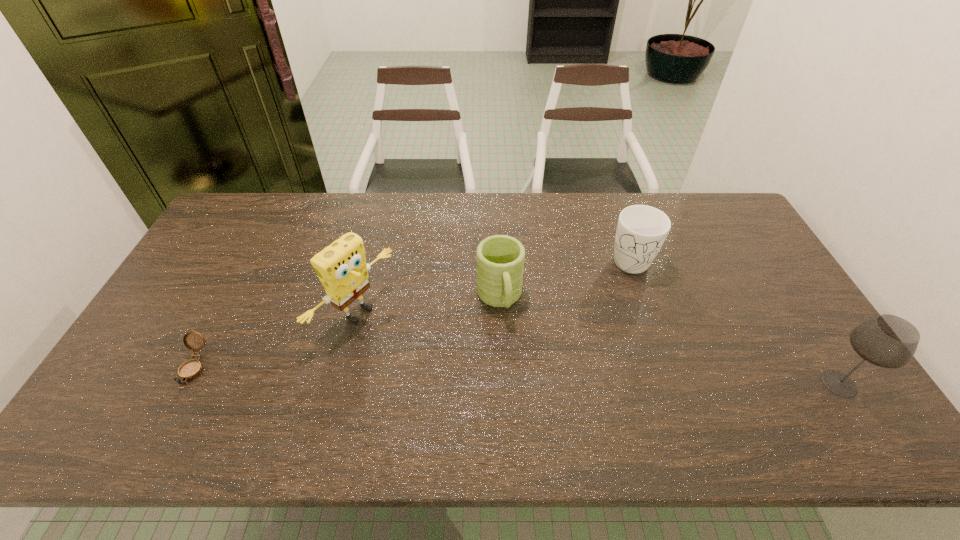
Locate an element on the screen. Image resolution: width=960 pixels, height=540 pixels. vacant spot on the desktop that is between the leftmost object and the wineglass and is positioned on the side of the third object from left to right with the handle is located at coordinates (518, 376).

At what (x,y) coordinates should I click in order to perform the action: click on free spot on the desktop that is between the shortest object and the rightmost object and is positioned on the face of the second object from left to right. Please return your answer as a coordinate pair (x, y). This screenshot has width=960, height=540. Looking at the image, I should click on (454, 374).

I want to click on vacant spot on the desktop that is between the leftmost object and the wineglass and is positioned on the side of the second object from right to left with the handle, so click(535, 376).